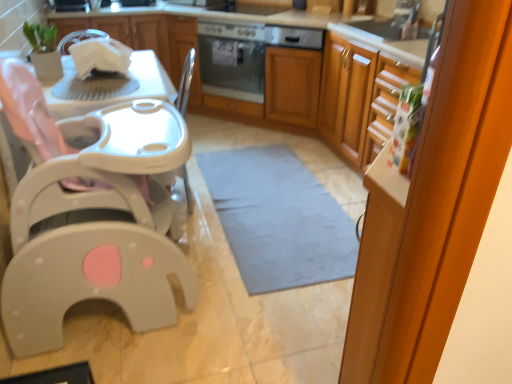
Where is `vacant area that is situated to the right of white plastic baby carriage at left`? vacant area that is situated to the right of white plastic baby carriage at left is located at coordinates (241, 310).